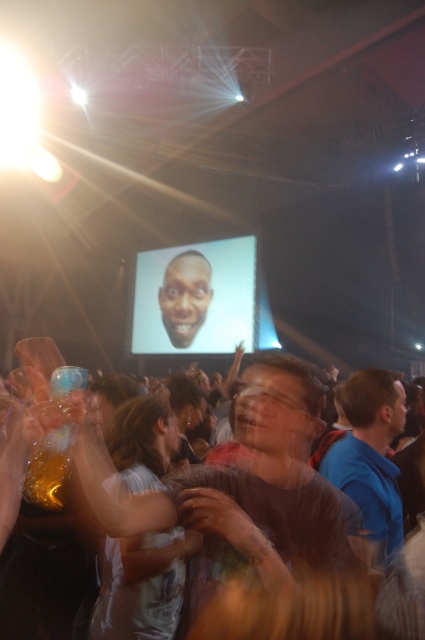
You are at a concert and want to take a photo of the blue fabric shirt at right without the matte plastic screen at center blocking it. How should you adjust your position?

Move to the right so that the blue fabric shirt at right is no longer aligned with the matte plastic screen at center, which is to its left.

You are a photographer at the concert and want to capture a photo where both the matte brown shirt at center and the matte plastic screen at center are clearly visible. Based on their sizes, which object should you focus on first to ensure both are in focus?

The matte brown shirt at center is not as tall as the matte plastic screen at center, so you should focus on the taller matte plastic screen at center first to ensure both are in focus.

You are a photographer at the concert and need to capture a clear photo of both the matte brown shirt at center and the white cotton shirt at center. Since the crowd is moving, you want to ensure both shirts are fully visible. Which shirt should you focus on first to ensure it fits in the frame?

The matte brown shirt at center has a larger width than the white cotton shirt at center, so you should focus on the matte brown shirt at center first to ensure it fits in the frame before the crowd moves.